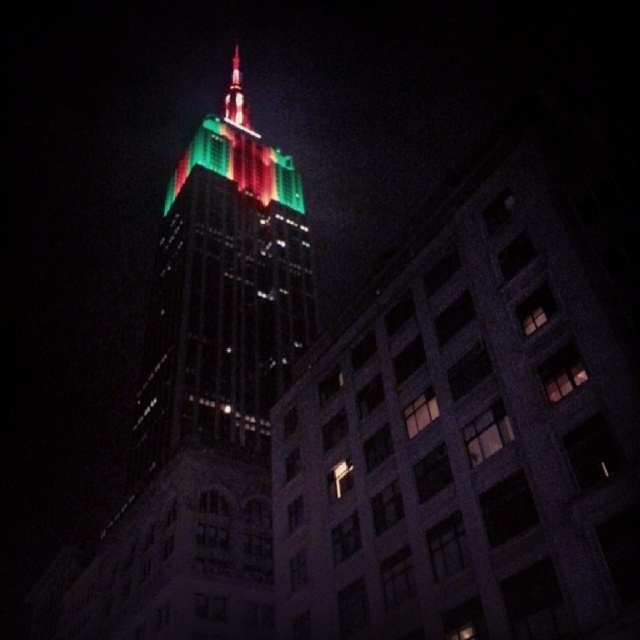
Is green glass skyscraper at center to the left of shiny glass spire at upper center from the viewer's perspective?

No, green glass skyscraper at center is not to the left of shiny glass spire at upper center.

Is green glass skyscraper at center to the right of shiny glass spire at upper center from the viewer's perspective?

Correct, you'll find green glass skyscraper at center to the right of shiny glass spire at upper center.

Find the location of `green glass skyscraper at center`. green glass skyscraper at center is located at coordinates (205, 404).